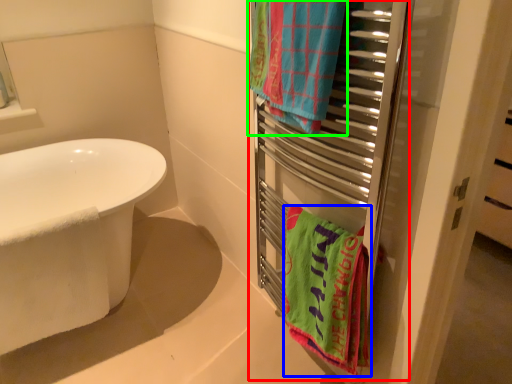
Question: Which is farther away from closet (highlighted by a red box)? towel/napkin (highlighted by a blue box) or towel/napkin (highlighted by a green box)?

Choices:
 (A) towel/napkin
 (B) towel/napkin

Answer: (B)